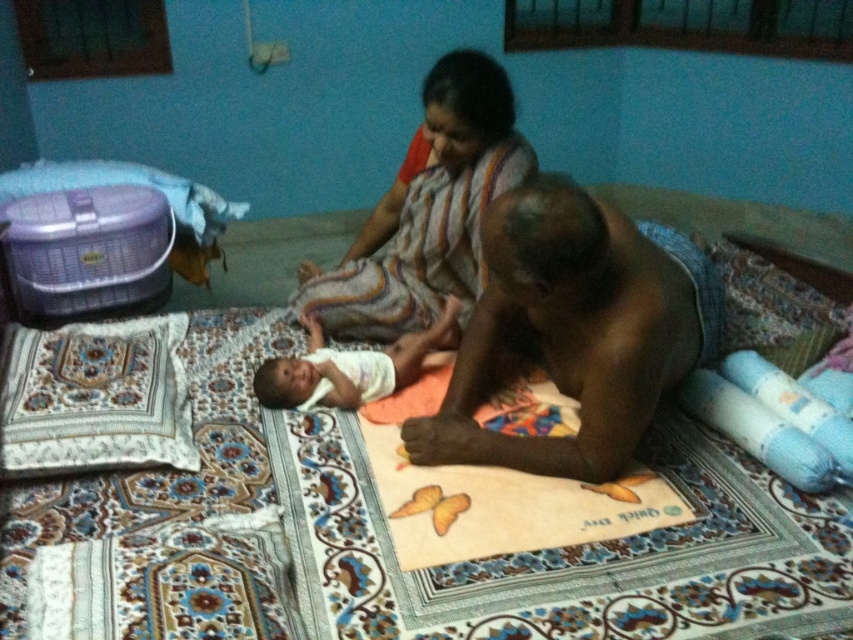
Question: Which object is positioned closest to the dark skin man at center?

Choices:
 (A) striped fabric woman at center
 (B) white cloth at center

Answer: (B)

Question: Which of the following is the farthest from the observer?

Choices:
 (A) pos(306,349)
 (B) pos(561,257)
 (C) pos(508,96)

Answer: (A)

Question: Does dark skin man at center appear on the right side of striped fabric woman at center?

Choices:
 (A) no
 (B) yes

Answer: (B)

Question: Does dark skin man at center appear over white cloth at center?

Choices:
 (A) no
 (B) yes

Answer: (A)

Question: Estimate the real-world distances between objects in this image. Which object is farther from the striped fabric woman at center?

Choices:
 (A) white cloth at center
 (B) dark skin man at center

Answer: (B)

Question: In this image, where is dark skin man at center located relative to striped fabric woman at center?

Choices:
 (A) above
 (B) below

Answer: (B)